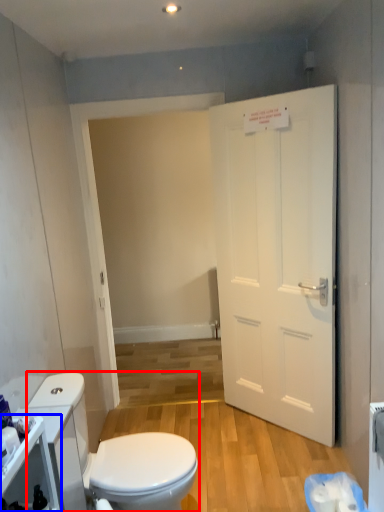
Question: Which point is closer to the camera, toilet (highlighted by a red box) or cabinetry (highlighted by a blue box)?

Choices:
 (A) toilet
 (B) cabinetry

Answer: (B)